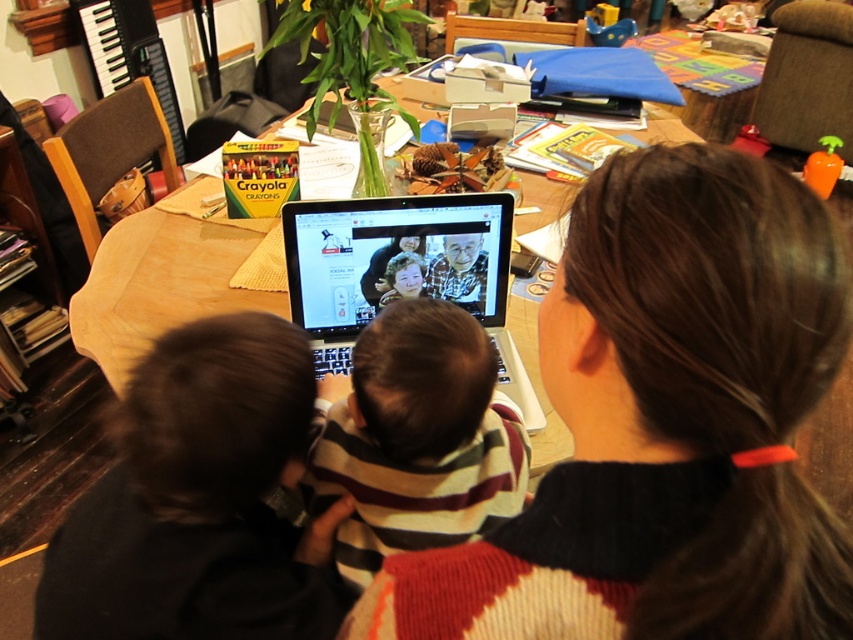
Between point (509, 483) and point (495, 301), which one is positioned behind?

The point (495, 301) is more distant.

Which is more to the right, striped sweater at center or black plastic laptop at center?

black plastic laptop at center

This screenshot has width=853, height=640. Describe the element at coordinates (416, 440) in the screenshot. I see `striped sweater at center` at that location.

Locate an element on the screen. The image size is (853, 640). striped sweater at center is located at coordinates (416, 440).

Who is more distant from viewer, (599, 339) or (99, 284)?

Point (99, 284)

Based on the photo, can you confirm if dark brown hair at center is positioned to the left of wooden table at center?

No, dark brown hair at center is not to the left of wooden table at center.

Where is `dark brown hair at center`? The width and height of the screenshot is (853, 640). dark brown hair at center is located at coordinates (665, 424).

How far apart are striped sweater at center and wooden table at center?

22.37 inches

The image size is (853, 640). Identify the location of striped sweater at center. (416, 440).

The height and width of the screenshot is (640, 853). Find the location of `striped sweater at center`. striped sweater at center is located at coordinates (416, 440).